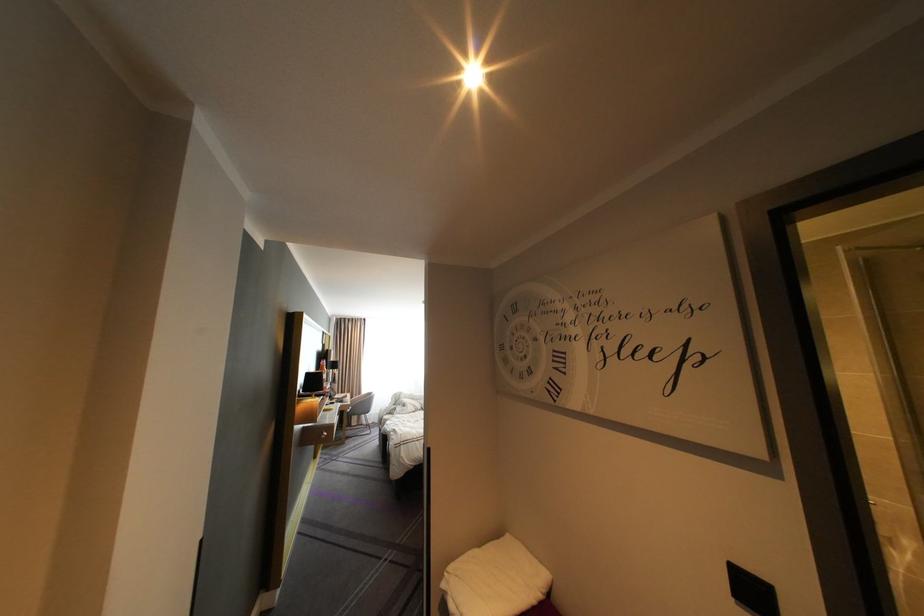
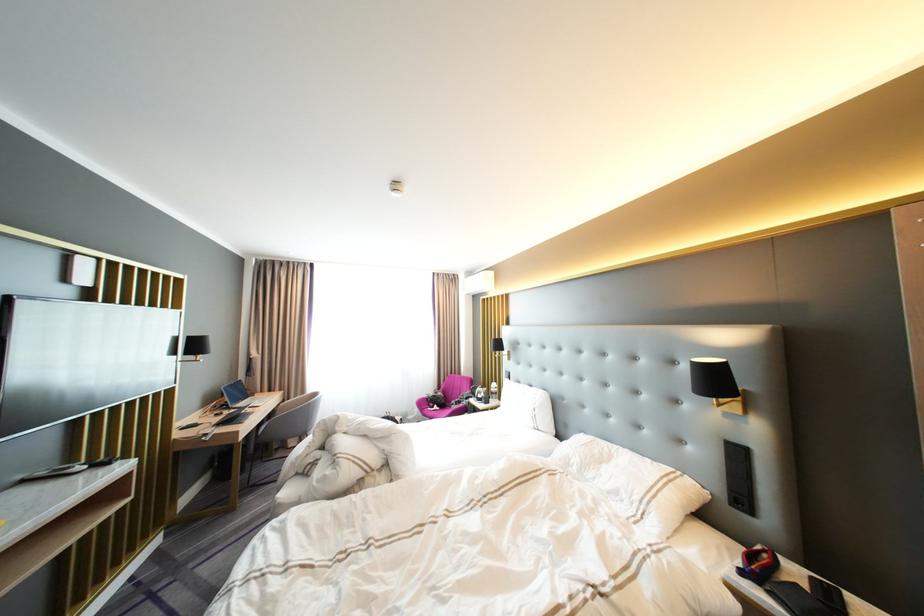
Question: Which direction would the cameraman need to move to produce the second image? Reply with the corresponding letter.

Choices:
 (A) Left
 (B) Right
 (C) Forward
 (D) Backward

Answer: (C)